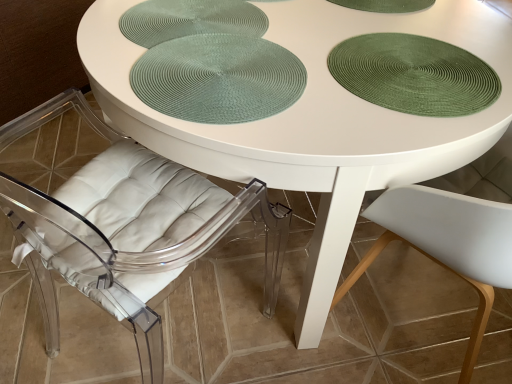
What are the coordinates of `free region under green woven placemat at center (from a real-world perspective)` in the screenshot? It's located at (238, 71).